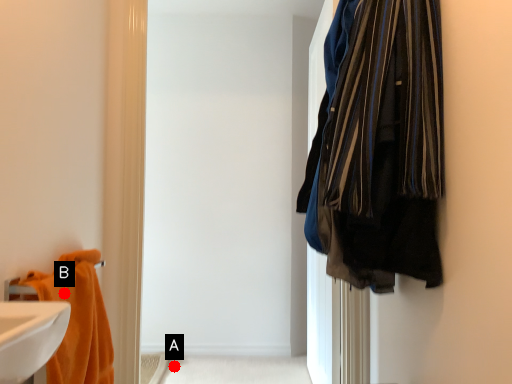
Question: Two points are circled on the image, labeled by A and B beside each circle. Which point appears farthest from the camera in this image?

Choices:
 (A) A is further
 (B) B is further

Answer: (A)